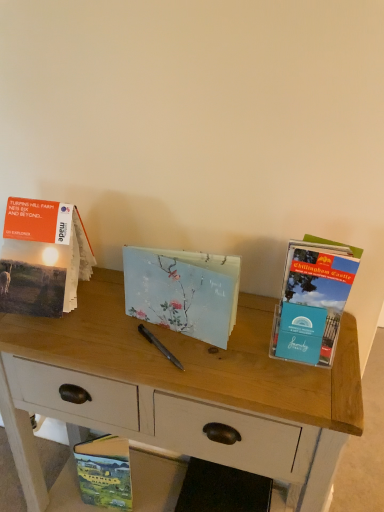
Question: Would you say wooden desk at center contains hardcover book at lower left, the 3th book from the right?

Choices:
 (A) no
 (B) yes

Answer: (B)

Question: From the image's perspective, is wooden desk at center on top of hardcover book at lower left, which appears as the 2th book when viewed from the left?

Choices:
 (A) no
 (B) yes

Answer: (B)

Question: Is wooden desk at center aimed at hardcover book at lower left, which is counted as the first book, starting from the bottom?

Choices:
 (A) yes
 (B) no

Answer: (A)

Question: Is wooden desk at center positioned far away from hardcover book at lower left, which appears as the 2th book when viewed from the left?

Choices:
 (A) yes
 (B) no

Answer: (B)

Question: From a real-world perspective, is wooden desk at center positioned under hardcover book at lower left, the 3th book from the right, based on gravity?

Choices:
 (A) no
 (B) yes

Answer: (A)

Question: From the image's perspective, is wooden desk at center located above or below hardcover book at lower left, arranged as the 4th book when viewed from the top?

Choices:
 (A) above
 (B) below

Answer: (A)

Question: Considering the positions of wooden desk at center and hardcover book at lower left, arranged as the 4th book when viewed from the top, in the image, is wooden desk at center wider or thinner than hardcover book at lower left, arranged as the 4th book when viewed from the top,?

Choices:
 (A) wide
 (B) thin

Answer: (A)

Question: In terms of height, does wooden desk at center look taller or shorter compared to hardcover book at lower left, which appears as the 2th book when viewed from the left?

Choices:
 (A) tall
 (B) short

Answer: (A)

Question: In the image, is wooden desk at center on the left side or the right side of hardcover book at lower left, which is counted as the first book, starting from the bottom?

Choices:
 (A) left
 (B) right

Answer: (B)

Question: In the image, is blue cardstock brochure at right, which is counted as the first book, starting from the right, positioned in front of or behind matte paper book at left, which appears as the fourth book when ordered from the bottom?

Choices:
 (A) behind
 (B) front

Answer: (B)

Question: In terms of size, does blue cardstock brochure at right, which appears as the third book when viewed from the top, appear bigger or smaller than matte paper book at left, the first book in the left-to-right sequence?

Choices:
 (A) big
 (B) small

Answer: (B)

Question: From the image's perspective, is blue cardstock brochure at right, which is the 2th book from bottom to top, located above or below matte paper book at left, which appears as the fourth book when ordered from the bottom?

Choices:
 (A) below
 (B) above

Answer: (A)

Question: Is blue cardstock brochure at right, which is the 2th book from bottom to top, wider or thinner than matte paper book at left, the first book in the left-to-right sequence?

Choices:
 (A) thin
 (B) wide

Answer: (A)

Question: From their relative heights in the image, would you say hardcover book at lower left, the 3th book from the right, is taller or shorter than wooden desk at center?

Choices:
 (A) short
 (B) tall

Answer: (A)

Question: Considering the relative positions of hardcover book at lower left, the 3th book from the right, and wooden desk at center in the image provided, is hardcover book at lower left, the 3th book from the right, to the left or to the right of wooden desk at center?

Choices:
 (A) right
 (B) left

Answer: (B)